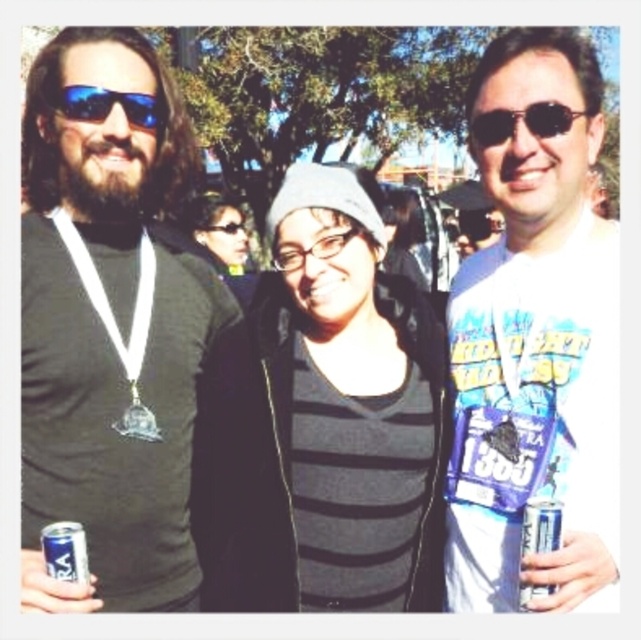
Measure the distance between matte black shirt at left and sunglasses at center.

matte black shirt at left is 7.92 feet from sunglasses at center.

Can you confirm if matte black shirt at left is positioned to the right of sunglasses at center?

No, matte black shirt at left is not to the right of sunglasses at center.

Describe the element at coordinates (129, 355) in the screenshot. The width and height of the screenshot is (641, 640). I see `matte black shirt at left` at that location.

Find the location of a particular element. matte black shirt at left is located at coordinates (129, 355).

Is matte black shirt at left smaller than silver metallic can at center right?

Actually, matte black shirt at left might be larger than silver metallic can at center right.

Between matte black shirt at left and silver metallic can at center right, which one has less height?

silver metallic can at center right is shorter.

Does point (158, 276) come closer to viewer compared to point (545, 509)?

That is False.

Locate an element on the screen. The image size is (641, 640). matte black shirt at left is located at coordinates (129, 355).

Between sunglasses at center and blue aluminum can at lower left, which one has less height?

Standing shorter between the two is sunglasses at center.

Between sunglasses at center and blue aluminum can at lower left, which one appears on the right side from the viewer's perspective?

sunglasses at center

Who is more distant from viewer, (538, 124) or (51, 572)?

Positioned behind is point (538, 124).

At what (x,y) coordinates should I click in order to perform the action: click on sunglasses at center. Please return your answer as a coordinate pair (x, y). The height and width of the screenshot is (640, 641). Looking at the image, I should click on (522, 122).